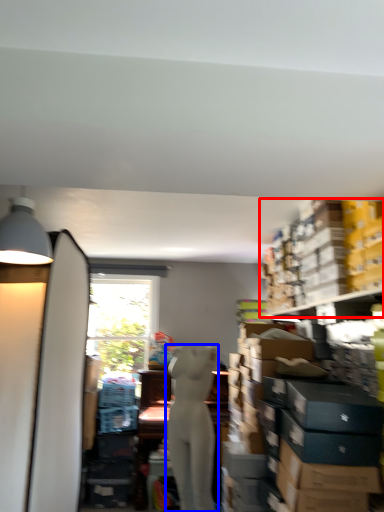
Question: Which object appears closest to the camera in this image, shelf (highlighted by a red box) or person (highlighted by a blue box)?

Choices:
 (A) shelf
 (B) person

Answer: (A)